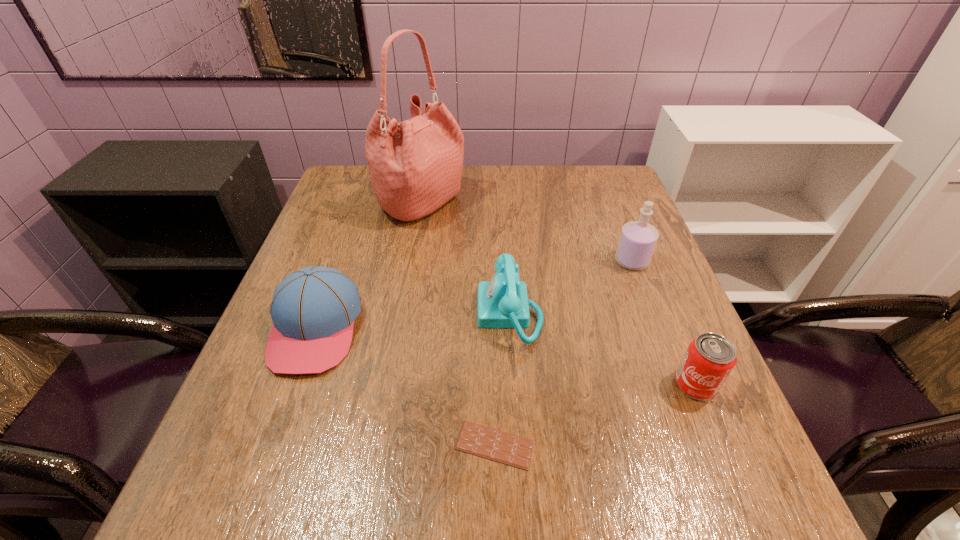
Find the location of a particular element. This screenshot has height=540, width=960. baseball cap present at the left edge is located at coordinates (313, 309).

Locate an element on the screen. The image size is (960, 540). perfume at the right edge is located at coordinates (638, 239).

I want to click on can at the right edge, so click(709, 359).

What are the coordinates of `object that is at the far left corner` in the screenshot? It's located at (415, 166).

Locate an element on the screen. This screenshot has width=960, height=540. free space at the far edge of the desktop is located at coordinates (566, 173).

The width and height of the screenshot is (960, 540). I want to click on vacant space at the near edge, so click(308, 514).

At what (x,y) coordinates should I click in order to perform the action: click on free space at the right edge. Please return your answer as a coordinate pair (x, y). Looking at the image, I should click on (582, 211).

This screenshot has height=540, width=960. Identify the location of free space between the can and the handbag. (559, 294).

Identify the location of empty space that is in between the telephone and the tallest object. (466, 259).

The height and width of the screenshot is (540, 960). In order to click on vacant space that is in between the fifth shortest object and the tallest object in this screenshot , I will do `click(527, 232)`.